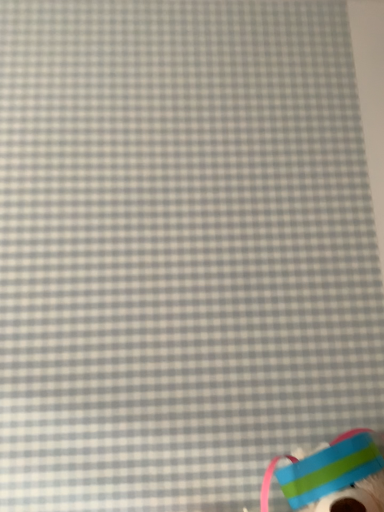
The width and height of the screenshot is (384, 512). Describe the element at coordinates (324, 469) in the screenshot. I see `plush toy with colorful bands at bottom right` at that location.

Identify the location of plush toy with colorful bands at bottom right. Image resolution: width=384 pixels, height=512 pixels. (324, 469).

Find the location of `plush toy with colorful bands at bottom right`. plush toy with colorful bands at bottom right is located at coordinates (324, 469).